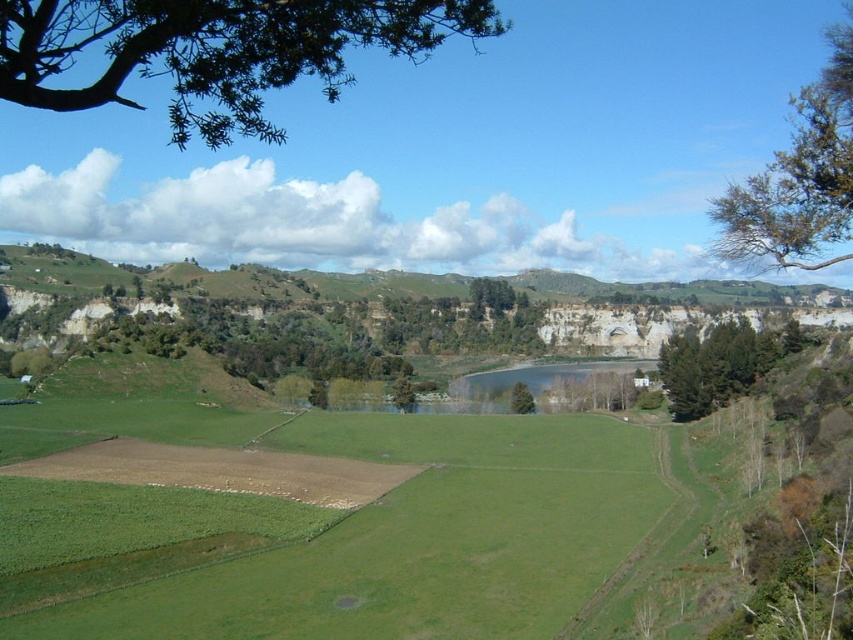
You are standing at the edge of the water and want to reach the green leafy tree at upper right. If your walking speed is 3 feet per second, how many seconds will it take to get there?

The distance between you and the green leafy tree at upper right is 182.46 feet. At a walking speed of 3 feet per second, it would take approximately 60.82 seconds to reach it.

You are standing at the center of the image and want to locate the green leafy tree at right. Based on the coordinates provided, in which direction should you look to find it?

The green leafy tree at right is located at coordinates point (x=720, y=364), so you should look to the right side of the image to find it.

You are a hiker standing at the edge of the green grassy lake at center. You want to reach the green leafy tree at upper right. Given that your average walking speed is 1.4 meters per second, how many minutes will it take you to walk directly to the tree?

The distance between the green leafy tree at upper right and the green grassy lake at center is 106.41 meters. At a walking speed of 1.4 meters per second, the time required is 106.41 divided by 1.4, which equals approximately 76 seconds. Converting seconds to minutes, this is roughly 1.27 minutes. Therefore, it will take about 1.27 minutes to reach the tree.